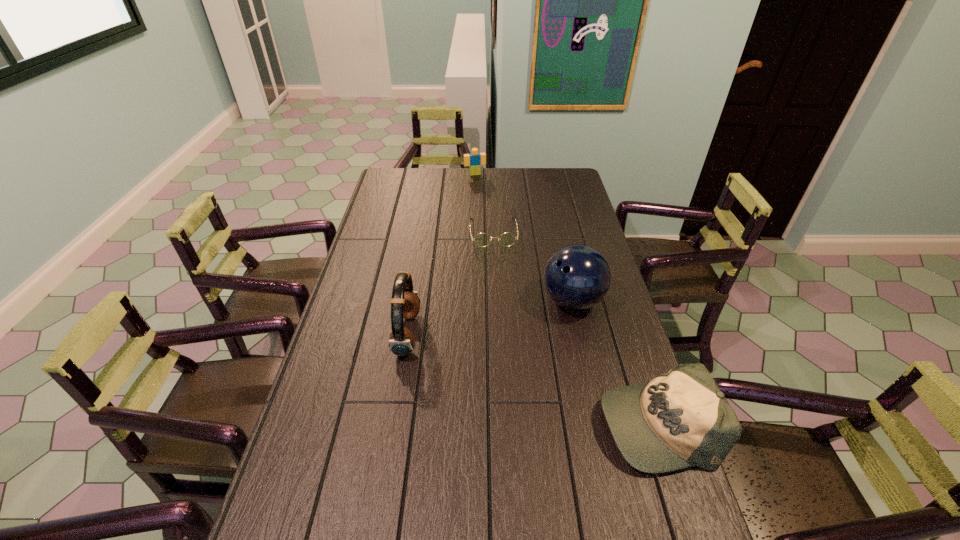
Find the location of a particular element. The image size is (960, 540). baseball cap present at the right edge is located at coordinates (680, 419).

The height and width of the screenshot is (540, 960). What are the coordinates of `bowling ball that is at the right edge` in the screenshot? It's located at (577, 277).

In the image, there is a desktop. Where is `vacant space at the far edge`? vacant space at the far edge is located at coordinates (508, 171).

At what (x,y) coordinates should I click in order to perform the action: click on free space at the left edge of the desktop. Please return your answer as a coordinate pair (x, y). The height and width of the screenshot is (540, 960). Looking at the image, I should click on (395, 198).

Where is `vacant area at the right edge of the desktop`? This screenshot has height=540, width=960. vacant area at the right edge of the desktop is located at coordinates (607, 347).

In the image, there is a desktop. Where is `vacant region at the far left corner`? This screenshot has height=540, width=960. vacant region at the far left corner is located at coordinates (406, 184).

Where is `vacant area at the far right corner of the desktop`? Image resolution: width=960 pixels, height=540 pixels. vacant area at the far right corner of the desktop is located at coordinates (560, 169).

Locate an element on the screen. free space between the fourth nearest object and the leftmost object is located at coordinates (450, 284).

I want to click on vacant space that's between the nearest object and the fourth nearest object, so point(575,328).

You are a GUI agent. You are given a task and a screenshot of the screen. Output one action in this format:
    pyautogui.click(x=<x>, y=<y>)
    Task: Click on the vacant space in between the bowling ball and the headset
    The image size is (960, 540).
    Given the screenshot: What is the action you would take?
    pyautogui.click(x=490, y=318)